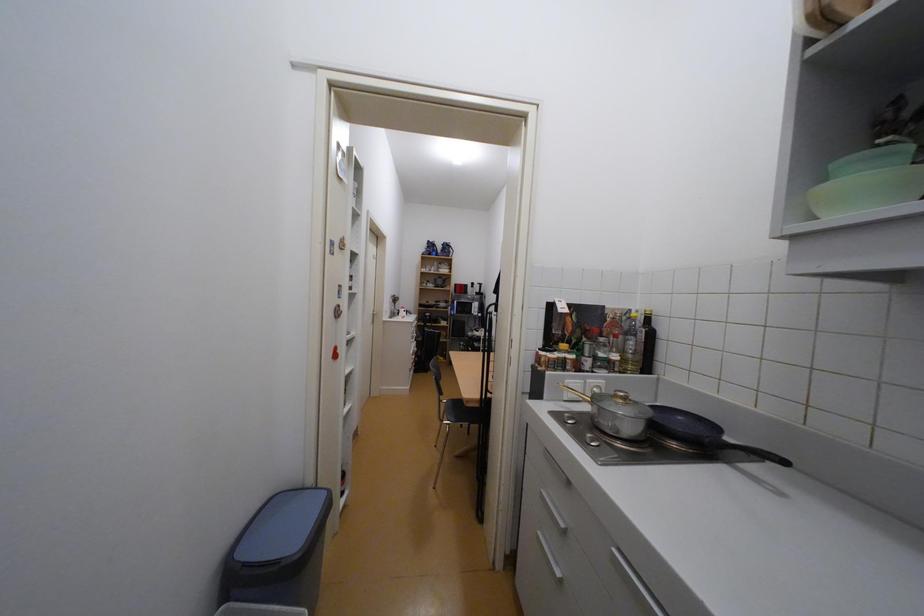
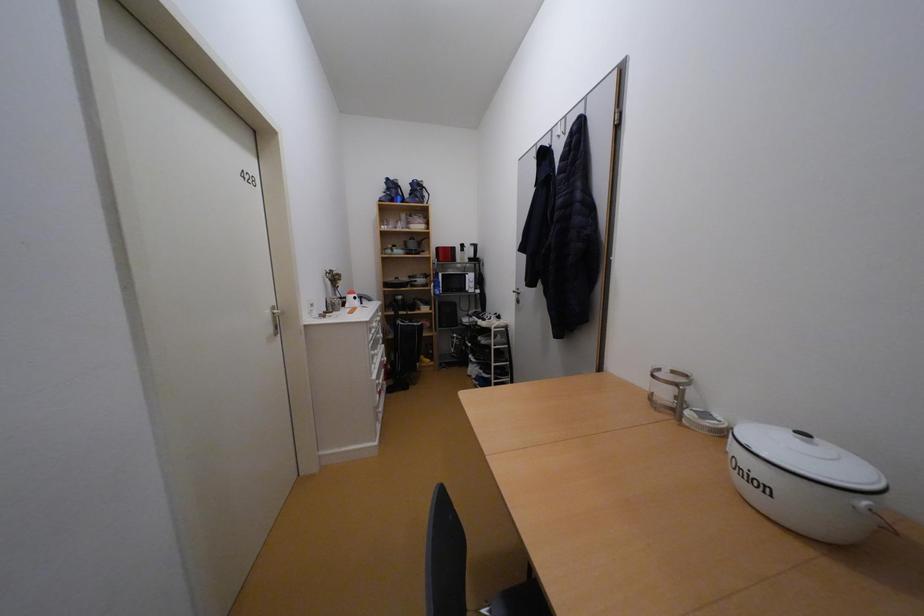
Question: The images are taken continuously from a first-person perspective. In which direction are you moving?

Choices:
 (A) Left
 (B) Right
 (C) Forward
 (D) Backward

Answer: (C)